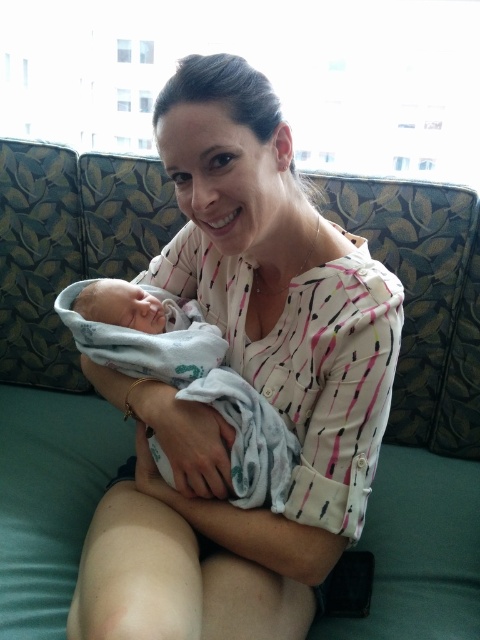
Question: Which point is farther to the camera?

Choices:
 (A) white cotton shirt at center
 (B) white soft swaddled newborn at center

Answer: (B)

Question: Which point is closer to the camera taking this photo?

Choices:
 (A) (200, 326)
 (B) (300, 483)

Answer: (B)

Question: Which object is closer to the camera taking this photo?

Choices:
 (A) white cotton shirt at center
 (B) white soft swaddled newborn at center

Answer: (A)

Question: Is white cotton shirt at center below white soft swaddled newborn at center?

Choices:
 (A) no
 (B) yes

Answer: (A)

Question: Can you confirm if white cotton shirt at center is bigger than white soft swaddled newborn at center?

Choices:
 (A) no
 (B) yes

Answer: (B)

Question: In this image, where is white cotton shirt at center located relative to white soft swaddled newborn at center?

Choices:
 (A) right
 (B) left

Answer: (A)